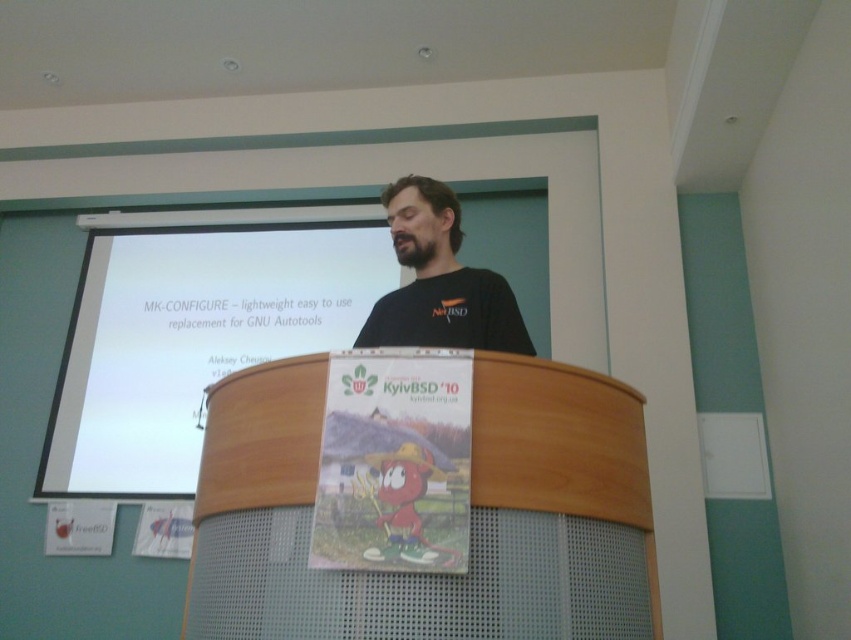
Question: Which object appears closest to the camera in this image?

Choices:
 (A) wooden podium at center
 (B) white matte projection screen at upper center

Answer: (A)

Question: Can you confirm if wooden podium at center is positioned to the left of black matte shirt at center?

Choices:
 (A) yes
 (B) no

Answer: (B)

Question: Among these objects, which one is farthest from the camera?

Choices:
 (A) white matte projection screen at upper center
 (B) wooden podium at center

Answer: (A)

Question: Does white matte projection screen at upper center have a lesser width compared to black matte shirt at center?

Choices:
 (A) no
 (B) yes

Answer: (A)

Question: Does wooden podium at center have a larger size compared to black matte shirt at center?

Choices:
 (A) no
 (B) yes

Answer: (B)

Question: Estimate the real-world distances between objects in this image. Which object is farther from the white matte projection screen at upper center?

Choices:
 (A) black matte shirt at center
 (B) wooden podium at center

Answer: (B)